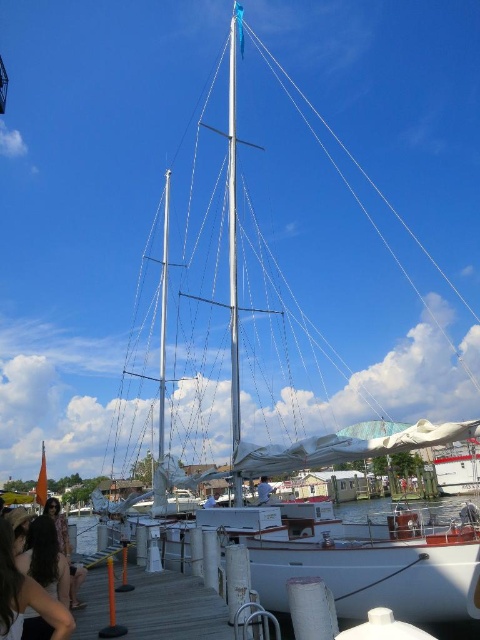
Question: Among these objects, which one is farthest from the camera?

Choices:
 (A) clear water at dock center
 (B) matte black hair at lower left
 (C) blue fabric sail at center

Answer: (C)

Question: Is the position of silver metallic mast at center more distant than that of clear water at dock center?

Choices:
 (A) yes
 (B) no

Answer: (A)

Question: Estimate the real-world distances between objects in this image. Which object is farther from the dark brown hair at lower left?

Choices:
 (A) white fabric sail at center
 (B) silver metallic mast at center

Answer: (B)

Question: Which of the following is the farthest from the observer?

Choices:
 (A) polished silver mast at center
 (B) matte black hair at lower left
 (C) dark brown hair at lower left

Answer: (A)

Question: Is silver metallic mast at center smaller than white fabric sail at center?

Choices:
 (A) yes
 (B) no

Answer: (B)

Question: Does silver metallic mast at center appear over matte black hair at lower left?

Choices:
 (A) no
 (B) yes

Answer: (B)